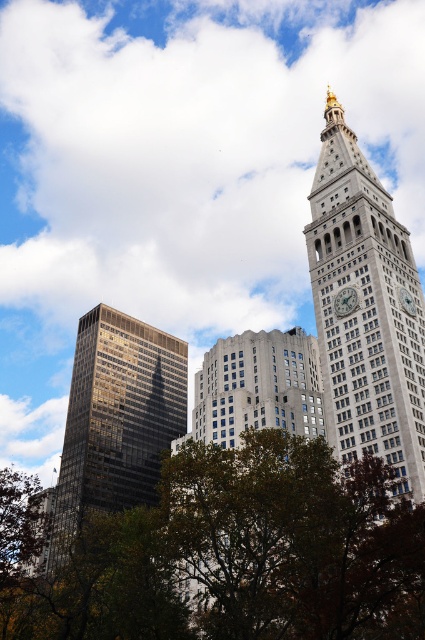
Question: Which point appears closest to the camera in this image?

Choices:
 (A) (102, 502)
 (B) (322, 307)
 (C) (343, 292)

Answer: (C)

Question: Can you confirm if green leafy tree at lower center is positioned to the left of reflective glass skyscraper at left?

Choices:
 (A) yes
 (B) no

Answer: (B)

Question: Which object appears closest to the camera in this image?

Choices:
 (A) gray stone clock tower at upper right
 (B) white glossy clock at upper right
 (C) reflective glass skyscraper at left
 (D) green leafy tree at lower center

Answer: (D)

Question: Is white marble clock at upper right bigger than white glossy clock at upper right?

Choices:
 (A) no
 (B) yes

Answer: (B)

Question: Which point is closer to the camera?

Choices:
 (A) white marble clock at upper right
 (B) white glossy clock at upper right
 (C) reflective glass skyscraper at left
 (D) gray stone clock tower at upper right

Answer: (D)

Question: Does green leafy tree at lower center appear on the left side of white marble clock at upper right?

Choices:
 (A) no
 (B) yes

Answer: (B)